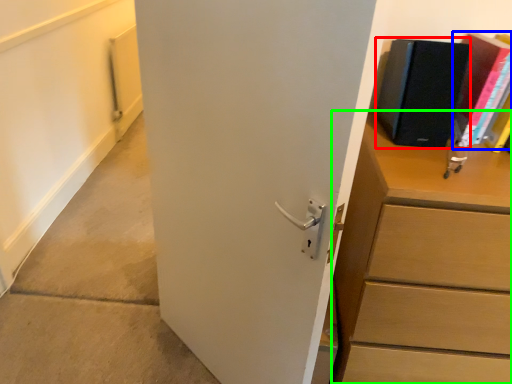
Question: Estimate the real-world distances between objects in this image. Which object is closer to paperback book (highlighted by a red box), paperback book (highlighted by a blue box) or chest of drawers (highlighted by a green box)?

Choices:
 (A) paperback book
 (B) chest of drawers

Answer: (A)